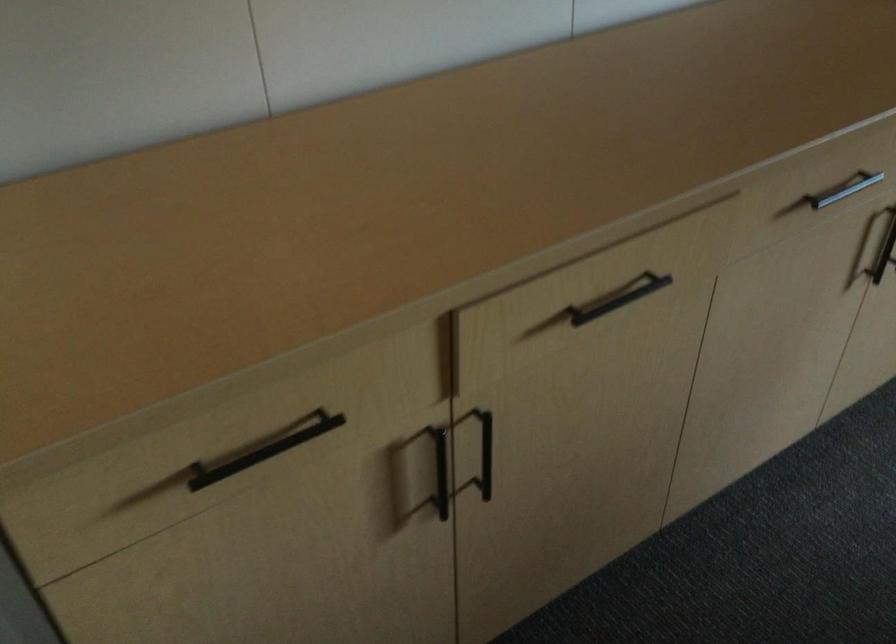
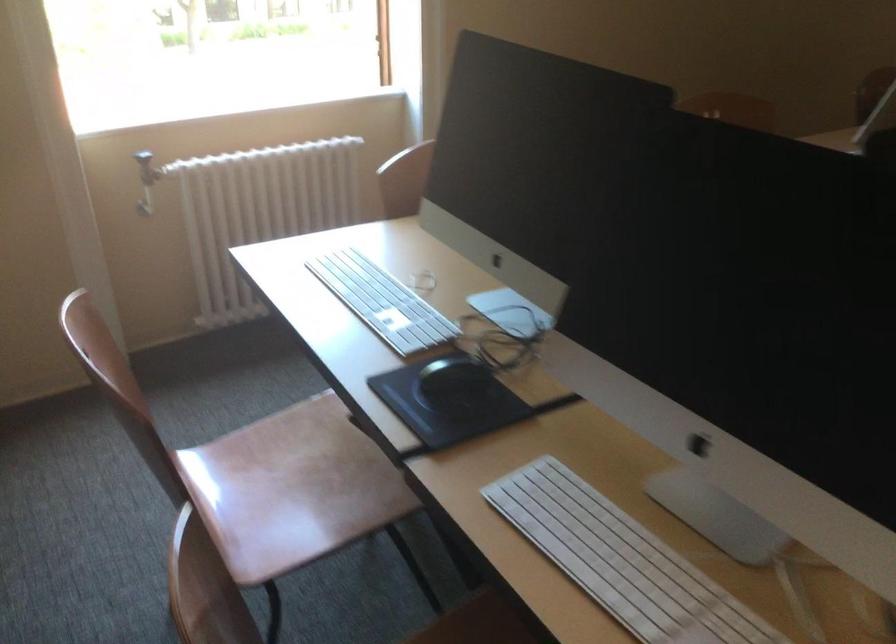
In the scene shown: The first image is from the beginning of the video and the second image is from the end. How did the camera likely rotate when shooting the video?

The rotation direction of the camera is right-down.